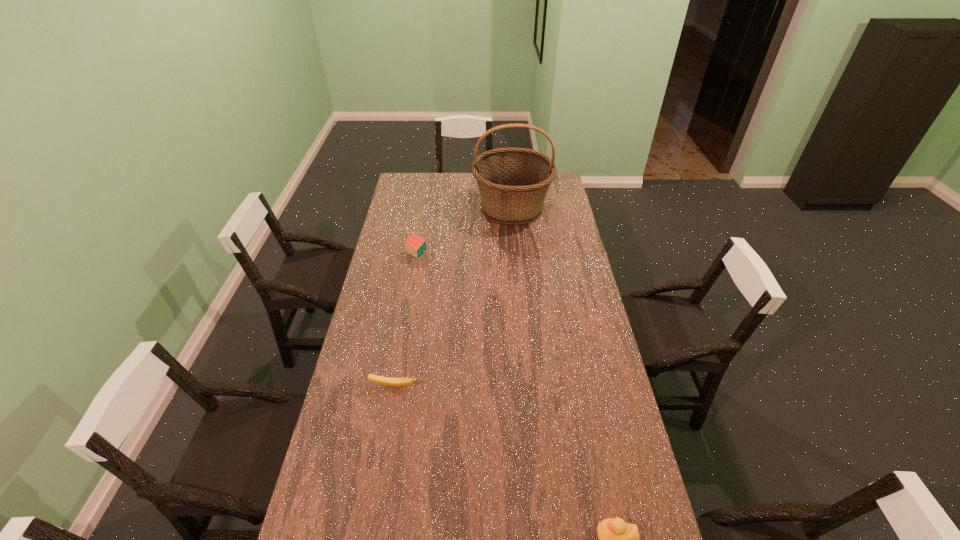
Identify the location of free space between the farthest object and the banana. (453, 297).

The height and width of the screenshot is (540, 960). What are the coordinates of `empty space between the tallest object and the cube` in the screenshot? It's located at (464, 231).

The height and width of the screenshot is (540, 960). In order to click on free spot between the third nearest object and the shortest object in this screenshot , I will do `click(405, 320)`.

Identify the location of the closest object to the nearest object. This screenshot has height=540, width=960. (381, 380).

The height and width of the screenshot is (540, 960). What are the coordinates of `object that stands as the second closest to the basket` in the screenshot? It's located at (381, 380).